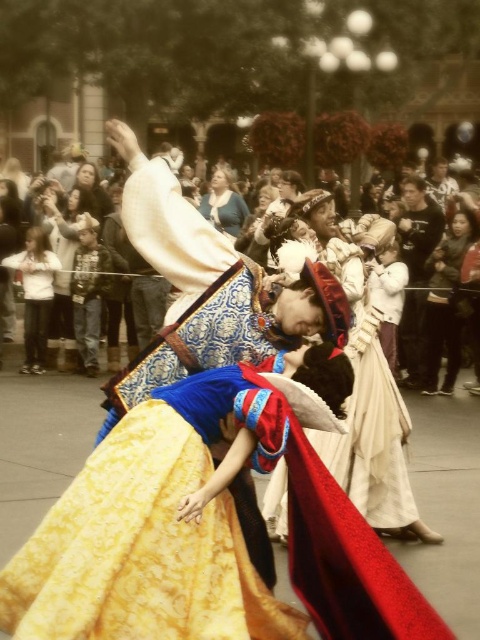
You are a photographer at the theme park event and want to capture a photo that includes both the yellow satin dress at center and the matte black jacket at left. Given their sizes, which object should you focus on to ensure both fit in the frame without cropping?

The yellow satin dress at center occupies less space than the matte black jacket at left, so you should focus on the matte black jacket at left as it is larger and will require more framing space to capture fully.

You are a photographer trying to capture a clear shot of both the matte black jacket at left and the matte blue dress at center. Based on their positions, which one is closer to the camera?

The matte black jacket at left is positioned under the matte blue dress at center, meaning it is closer to the camera.